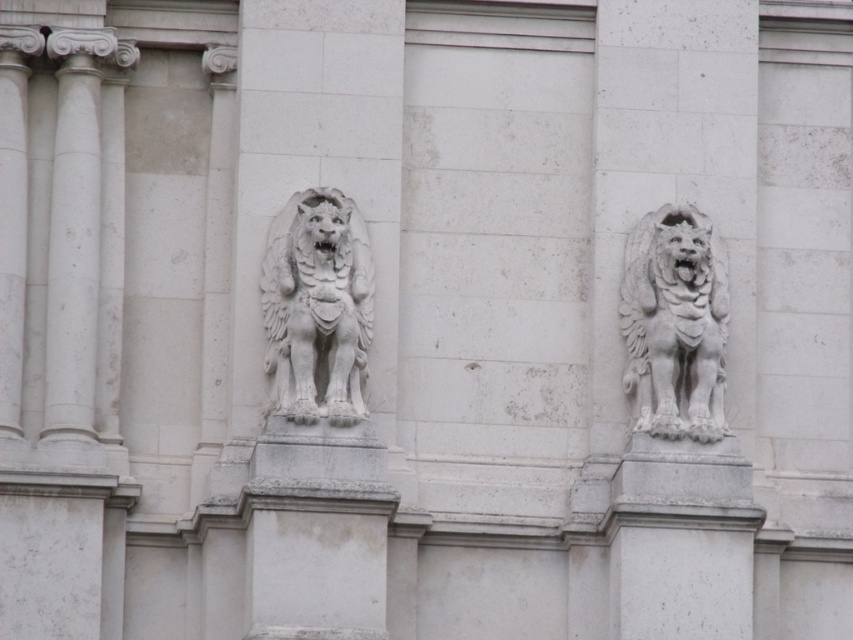
Which is behind, point (299, 285) or point (664, 406)?

Positioned behind is point (299, 285).

Is point (276, 413) positioned in front of point (635, 228)?

Yes, point (276, 413) is closer to viewer.

Identify the location of white stone lion at center. (317, 307).